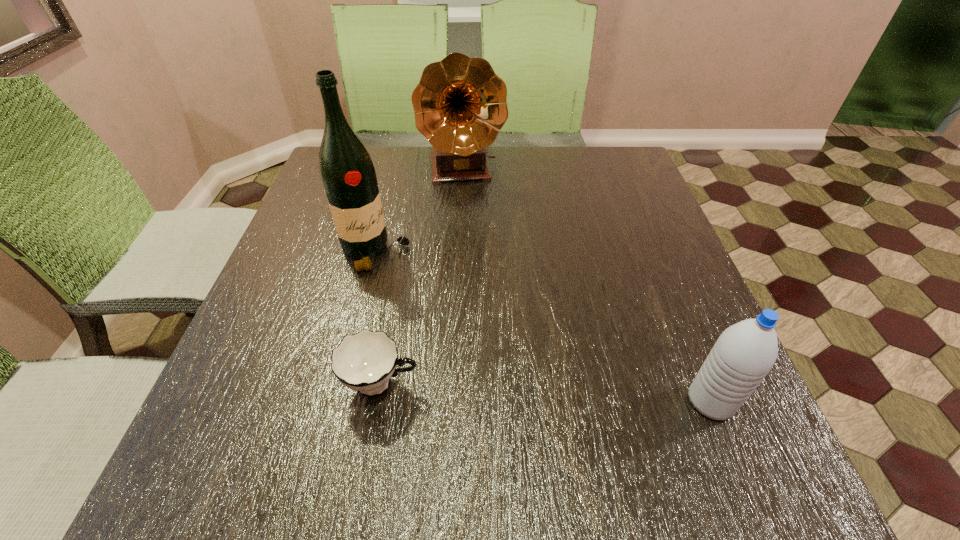
The width and height of the screenshot is (960, 540). In the image, there is a desktop. Find the location of `vacant area at the far edge`. vacant area at the far edge is located at coordinates (569, 149).

Find the location of a particular element. The width and height of the screenshot is (960, 540). vacant area at the near edge of the desktop is located at coordinates (526, 429).

Identify the location of vacant space at the left edge of the desktop. (347, 263).

The width and height of the screenshot is (960, 540). Find the location of `vacant space at the right edge`. vacant space at the right edge is located at coordinates (633, 333).

The height and width of the screenshot is (540, 960). What are the coordinates of `vacant space at the far right corner of the desktop` in the screenshot? It's located at (616, 154).

The height and width of the screenshot is (540, 960). What are the coordinates of `free point at the near right corner` in the screenshot? It's located at (684, 411).

Find the location of a particular element. vacant region between the rightmost object and the farthest object is located at coordinates (588, 286).

Where is `vacant area that lies between the second tallest object and the shortest object`? This screenshot has height=540, width=960. vacant area that lies between the second tallest object and the shortest object is located at coordinates (422, 278).

I want to click on vacant area that lies between the rightmost object and the third nearest object, so click(x=543, y=327).

Image resolution: width=960 pixels, height=540 pixels. Identify the location of free space between the phonograph_record and the cup. click(422, 278).